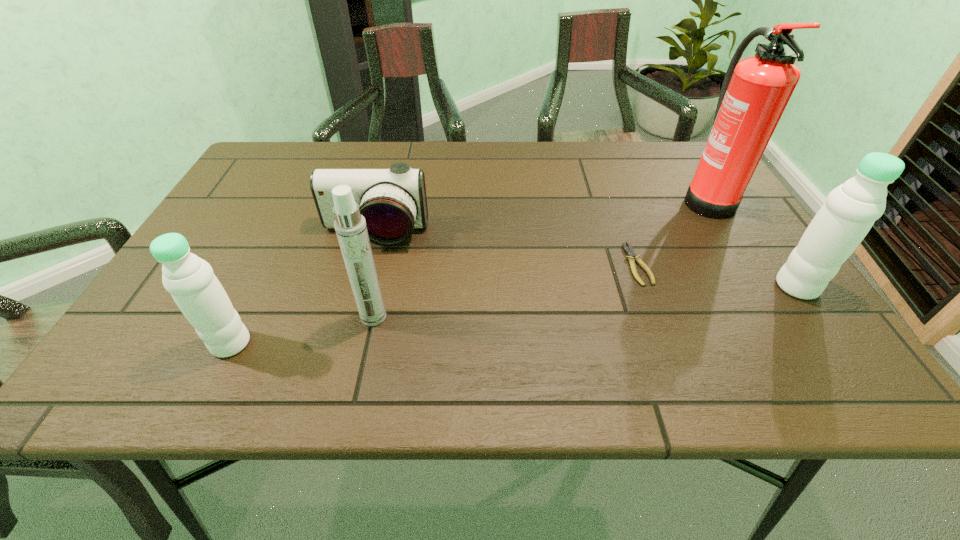
Where is `object that is at the left edge`? The width and height of the screenshot is (960, 540). object that is at the left edge is located at coordinates (190, 280).

At what (x,y) coordinates should I click in order to perform the action: click on water bottle located at the right edge. Please return your answer as a coordinate pair (x, y). Looking at the image, I should click on (850, 210).

Locate an element on the screen. This screenshot has width=960, height=540. fire extinguisher that is at the right edge is located at coordinates (755, 92).

The image size is (960, 540). I want to click on object positioned at the near left corner, so click(190, 280).

The width and height of the screenshot is (960, 540). Identify the location of object at the far right corner. (755, 92).

The image size is (960, 540). What are the coordinates of `vacant space at the far edge of the desktop` in the screenshot? It's located at (354, 163).

Find the location of a particular element. The height and width of the screenshot is (540, 960). free space at the near edge of the desktop is located at coordinates (337, 310).

Image resolution: width=960 pixels, height=540 pixels. What are the coordinates of `vacant space at the left edge` in the screenshot? It's located at (252, 192).

Find the location of a particular element. free region at the right edge of the desktop is located at coordinates (666, 186).

This screenshot has height=540, width=960. Identify the location of vacant space at the far left corner of the desktop. [259, 184].